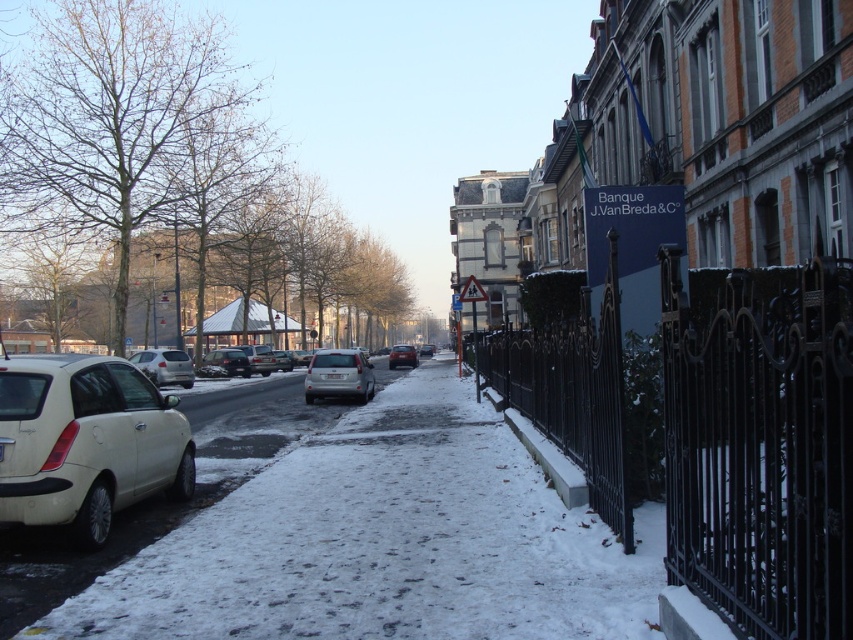
Does satin silver sedan at center have a smaller size compared to matte silver sedan at center?

Actually, satin silver sedan at center might be larger than matte silver sedan at center.

Between satin silver sedan at center and matte silver sedan at center, which one is positioned higher?

satin silver sedan at center is above.

Between point (320, 352) and point (207, 362), which one is positioned in front?

Point (320, 352) is more forward.

Locate an element on the screen. This screenshot has width=853, height=640. satin silver sedan at center is located at coordinates (338, 376).

In the scene shown: Can you confirm if matte silver sedan at center is positioned to the left of metallic silver car at center?

In fact, matte silver sedan at center is to the right of metallic silver car at center.

Which of these two, matte silver sedan at center or metallic silver car at center, stands shorter?

Standing shorter between the two is matte silver sedan at center.

What do you see at coordinates (228, 362) in the screenshot? I see `matte silver sedan at center` at bounding box center [228, 362].

The height and width of the screenshot is (640, 853). I want to click on matte silver sedan at center, so click(x=228, y=362).

Between white snow at lower center and metallic silver car at center, which one has less height?

white snow at lower center is shorter.

Which is above, white snow at lower center or metallic silver car at center?

metallic silver car at center

Image resolution: width=853 pixels, height=640 pixels. What are the coordinates of `white snow at lower center` in the screenshot? It's located at (383, 541).